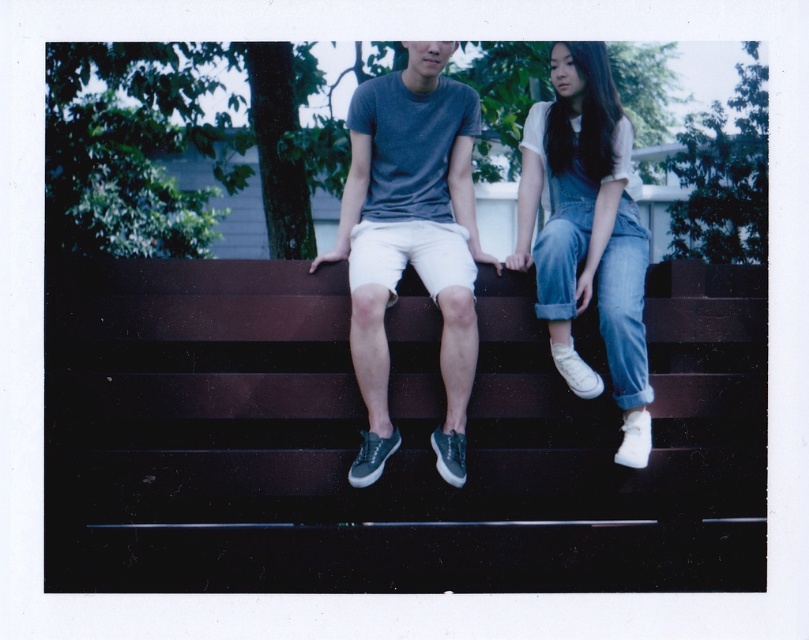
Question: Which point appears farthest from the camera in this image?

Choices:
 (A) (363, 356)
 (B) (600, 74)

Answer: (B)

Question: Which point appears closest to the camera in this image?

Choices:
 (A) (557, 248)
 (B) (418, 112)

Answer: (A)

Question: Considering the relative positions of matte gray t-shirt at center and denim overalls at right in the image provided, where is matte gray t-shirt at center located with respect to denim overalls at right?

Choices:
 (A) left
 (B) right

Answer: (A)

Question: Considering the relative positions of matte gray t-shirt at center and denim overalls at right in the image provided, where is matte gray t-shirt at center located with respect to denim overalls at right?

Choices:
 (A) right
 (B) left

Answer: (B)

Question: In this image, where is matte gray t-shirt at center located relative to denim overalls at right?

Choices:
 (A) above
 (B) below

Answer: (A)